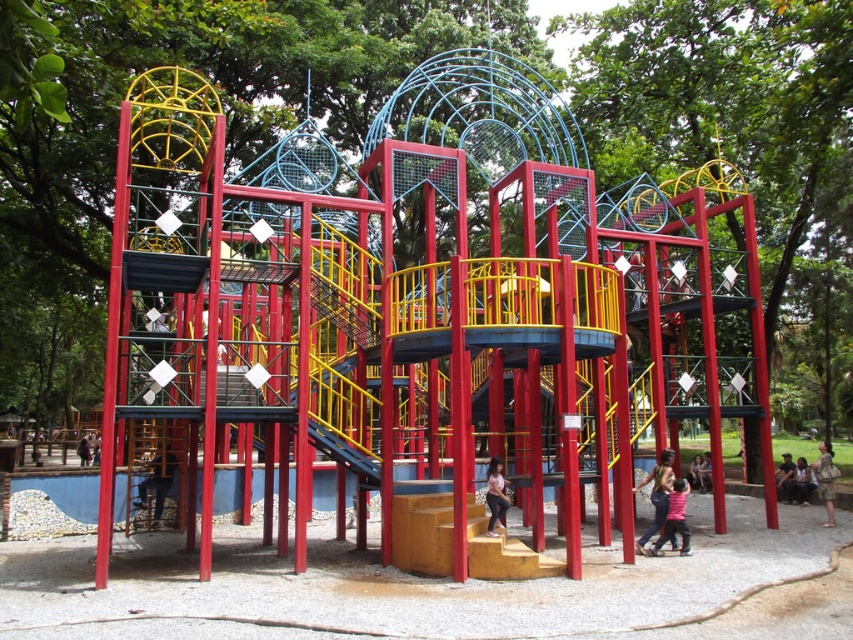
Between point (672, 518) and point (828, 492), which one is positioned behind?

The point (828, 492) is behind.

This screenshot has width=853, height=640. What do you see at coordinates (674, 518) in the screenshot?
I see `pink matte shirt at lower center` at bounding box center [674, 518].

The image size is (853, 640). In order to click on pink matte shirt at lower center in this screenshot , I will do `click(674, 518)`.

Is camouflage fabric shirt at lower right above pink fabric dress at center?

Yes, camouflage fabric shirt at lower right is above pink fabric dress at center.

Which is above, camouflage fabric shirt at lower right or pink fabric dress at center?

camouflage fabric shirt at lower right

Image resolution: width=853 pixels, height=640 pixels. What do you see at coordinates (825, 480) in the screenshot?
I see `camouflage fabric shirt at lower right` at bounding box center [825, 480].

Where is `camouflage fabric shirt at lower right`? camouflage fabric shirt at lower right is located at coordinates (825, 480).

Between matte black shirt at lower left and matte pink shirt at center, which one has less height?

Standing shorter between the two is matte pink shirt at center.

Is matte black shirt at lower left below matte pink shirt at center?

Correct, matte black shirt at lower left is located below matte pink shirt at center.

Does point (167, 490) lie behind point (665, 477)?

Yes, it is.

You are a GUI agent. You are given a task and a screenshot of the screen. Output one action in this format:
    pyautogui.click(x=<x>, y=<y>)
    Task: Click on the matte black shirt at lower left
    The width and height of the screenshot is (853, 640).
    Given the screenshot: What is the action you would take?
    pyautogui.click(x=157, y=481)